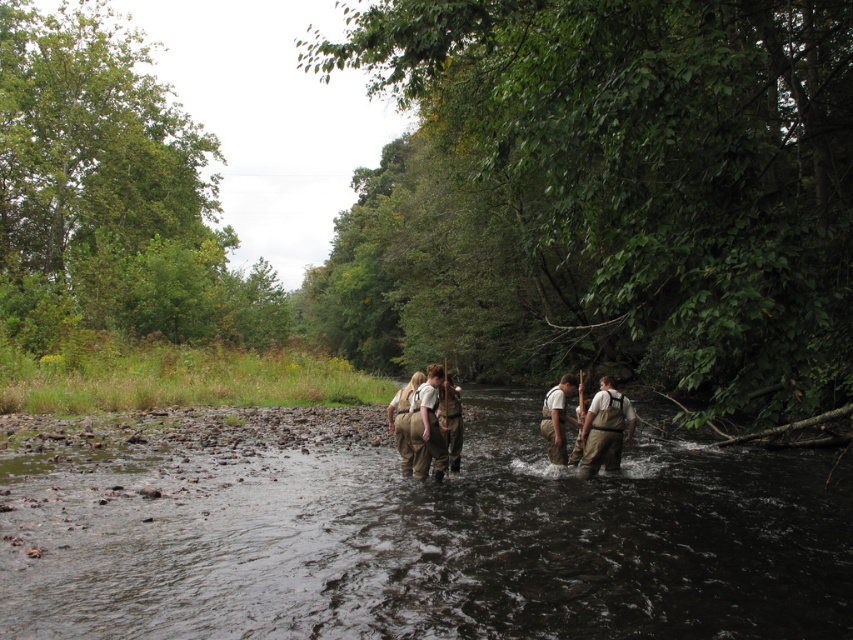
You are a hiker trying to cross the river. You see the brown fabric river at center and the brown fabric pants at center. Which one is located to the left side from your perspective?

The brown fabric river at center is located to the left of the brown fabric pants at center.

In the scene shown: You are a photographer positioned at the riverbank observing the scene. You want to capture a photo where both the brown cotton shirt at center and the brown leather backpack at center are visible. Based on their sizes, which object will occupy more space in the photo?

The brown cotton shirt at center has a greater width than the brown leather backpack at center, so it will occupy more space in the photo.